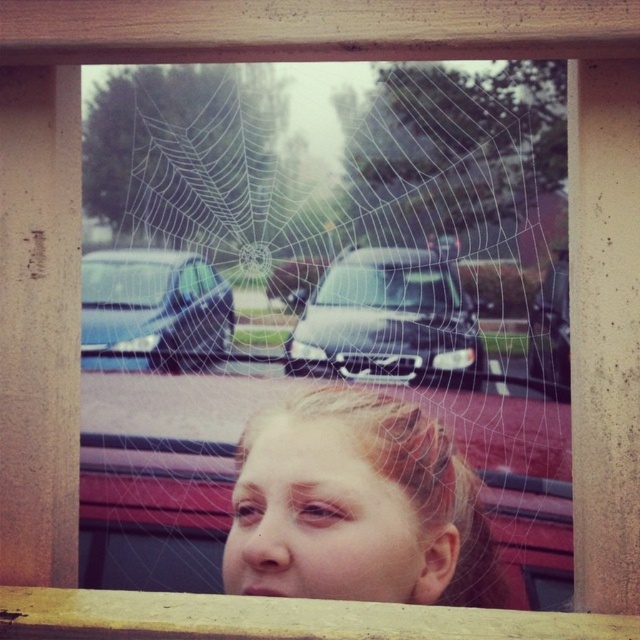
Question: Is smooth skin face at center in front of satin black car at center?

Choices:
 (A) yes
 (B) no

Answer: (A)

Question: Does transparent glass spider web at center appear over satin black car at center?

Choices:
 (A) yes
 (B) no

Answer: (B)

Question: Is transparent glass spider web at center positioned at the back of satin black car at center?

Choices:
 (A) no
 (B) yes

Answer: (A)

Question: Which of these objects is positioned farthest from the smooth skin face at center?

Choices:
 (A) transparent glass spider web at center
 (B) satin black car at center
 (C) metallic silver car at center

Answer: (C)

Question: Which point appears closest to the camera in this image?

Choices:
 (A) (268, 516)
 (B) (380, 321)
 (C) (260, 227)
 (D) (182, 300)

Answer: (A)

Question: Estimate the real-world distances between objects in this image. Which object is closer to the smooth skin face at center?

Choices:
 (A) transparent glass spider web at center
 (B) metallic silver car at center
 (C) satin black car at center

Answer: (A)